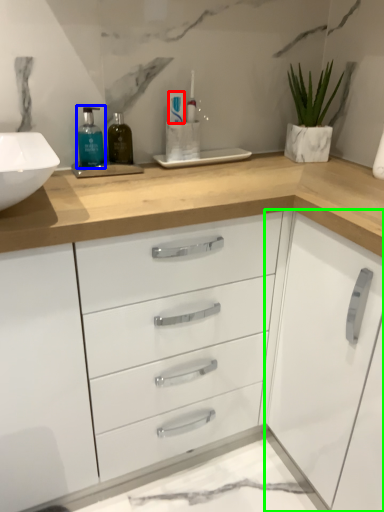
Question: Which is nearer to the toothpaste (highlighted by a red box)? mouthwash (highlighted by a blue box) or cabinetry (highlighted by a green box).

Choices:
 (A) mouthwash
 (B) cabinetry

Answer: (A)